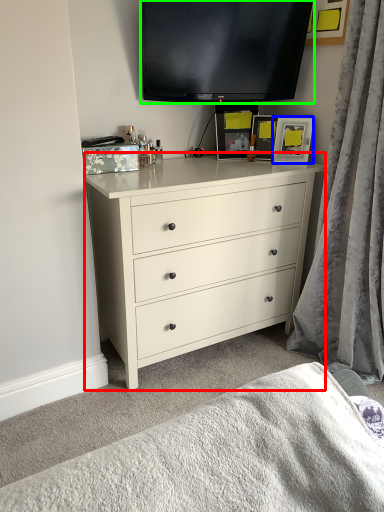
Question: Considering the real-world distances, which object is closest to chest of drawers (highlighted by a red box)? picture frame (highlighted by a blue box) or television (highlighted by a green box).

Choices:
 (A) picture frame
 (B) television

Answer: (A)